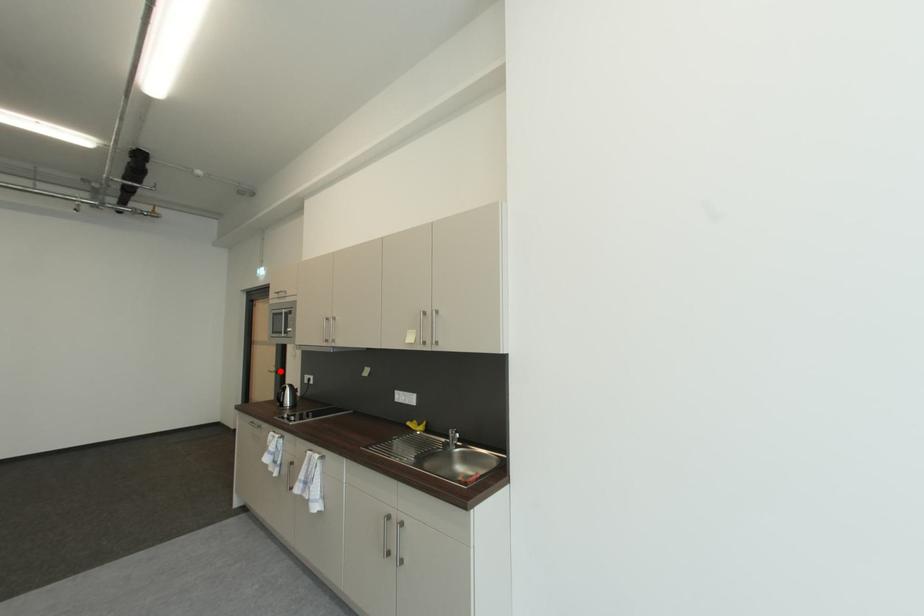
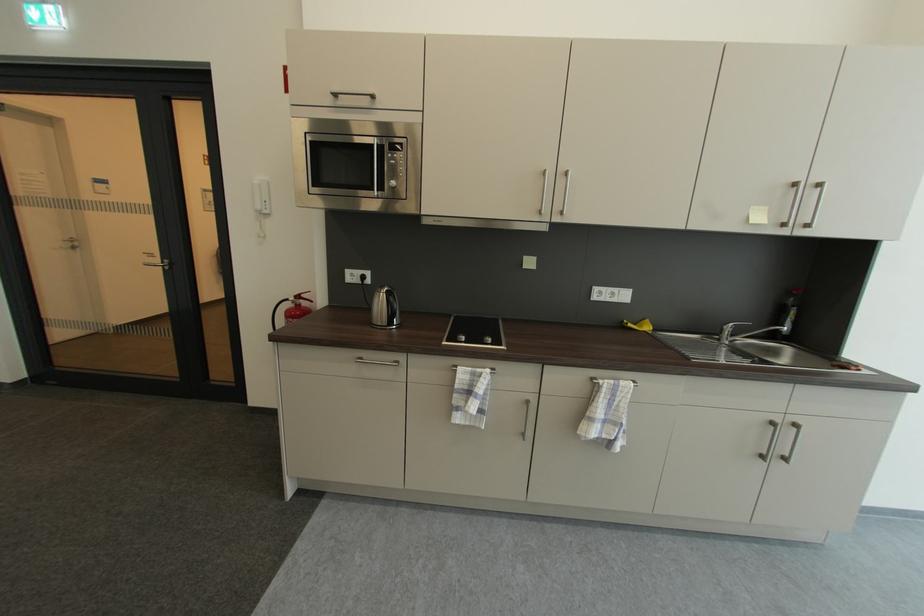
Where in the second image is the point corresponding to the highlighted location from the first image?

(163, 262)